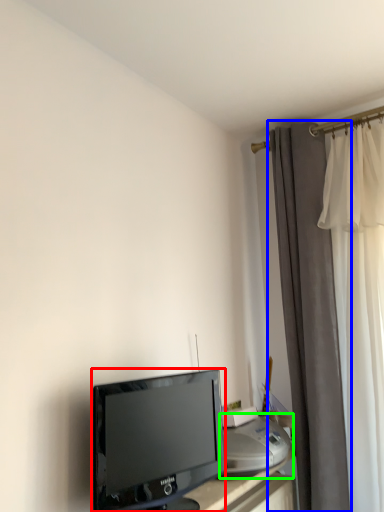
Question: Which object is the closest to the television (highlighted by a red box)? Choose among these: curtain (highlighted by a blue box) or printer (highlighted by a green box).

Choices:
 (A) curtain
 (B) printer

Answer: (B)